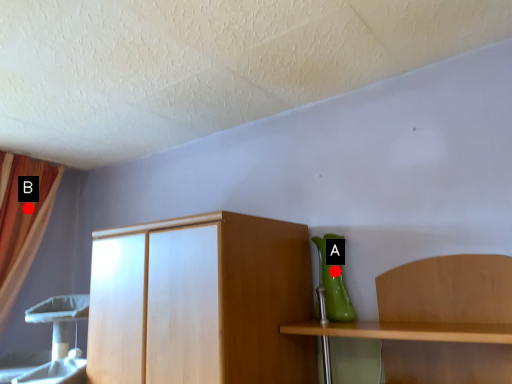
Question: Two points are circled on the image, labeled by A and B beside each circle. Which of the following is the closest to the observer?

Choices:
 (A) A is closer
 (B) B is closer

Answer: (A)